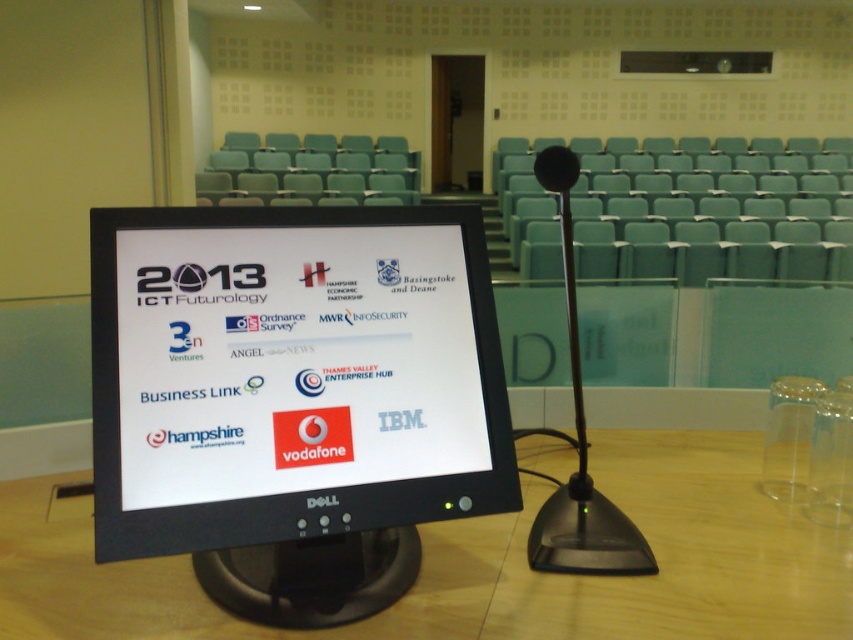
Question: Where is black plastic monitor at center located in relation to wooden table at center in the image?

Choices:
 (A) above
 (B) below

Answer: (A)

Question: Which point is closer to the camera?

Choices:
 (A) (183, 216)
 (B) (416, 621)

Answer: (B)

Question: Is black plastic monitor at center closer to camera compared to wooden table at center?

Choices:
 (A) yes
 (B) no

Answer: (A)

Question: Which object is farther from the camera taking this photo?

Choices:
 (A) wooden table at center
 (B) black plastic monitor at center

Answer: (A)

Question: Can you confirm if black plastic monitor at center is positioned above wooden table at center?

Choices:
 (A) yes
 (B) no

Answer: (A)

Question: Which of the following is the farthest from the observer?

Choices:
 (A) (480, 310)
 (B) (831, 634)

Answer: (A)